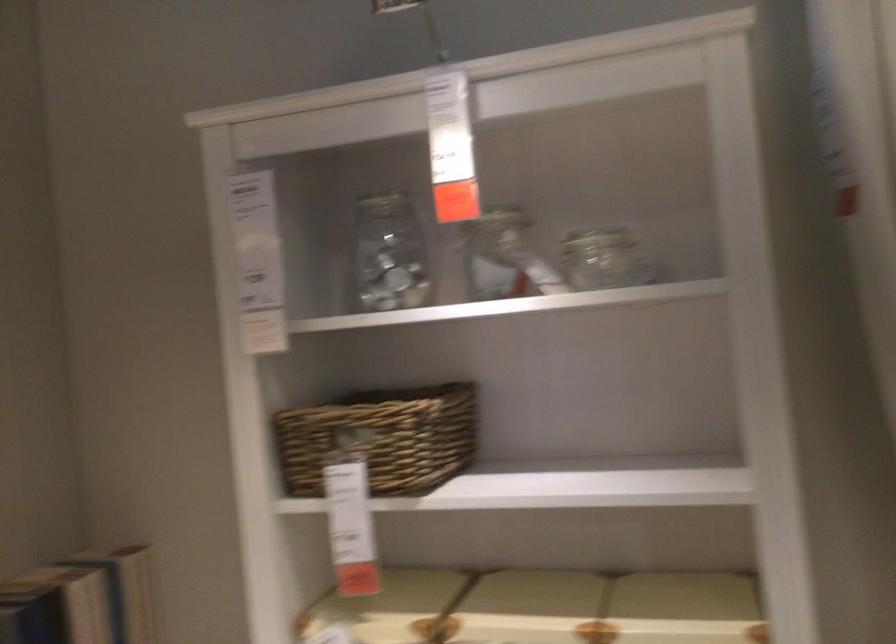
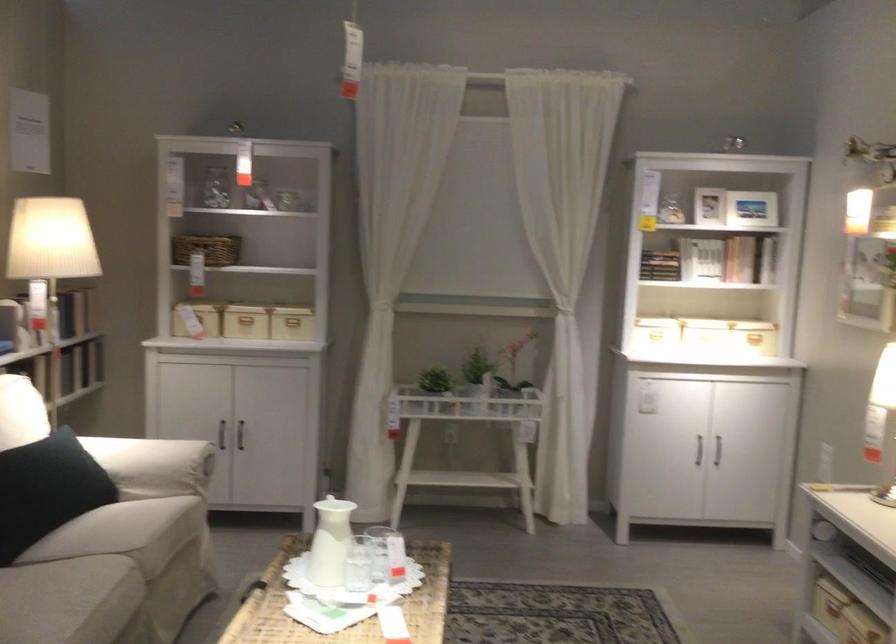
In the second image, find the point that corresponds to point 325,467 in the first image.

(207, 249)